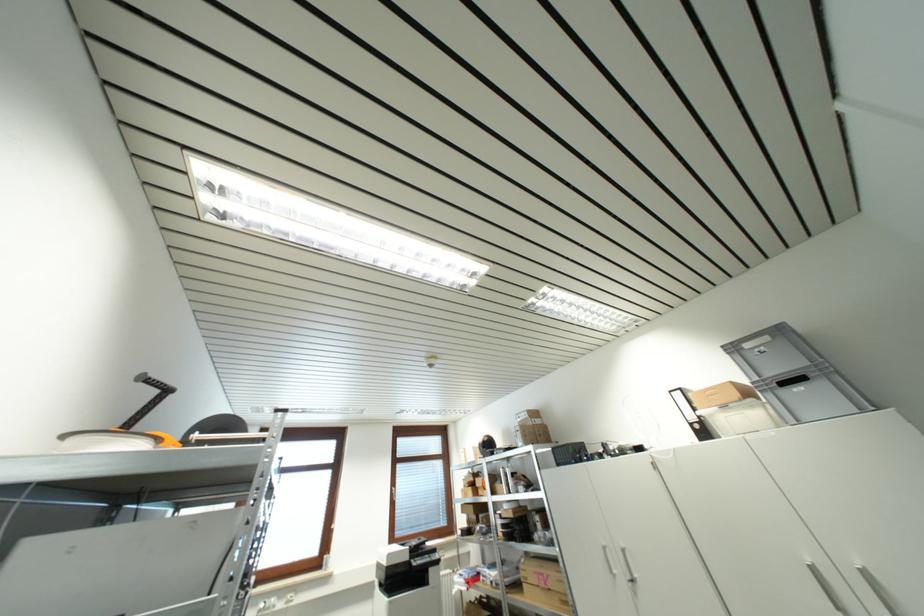
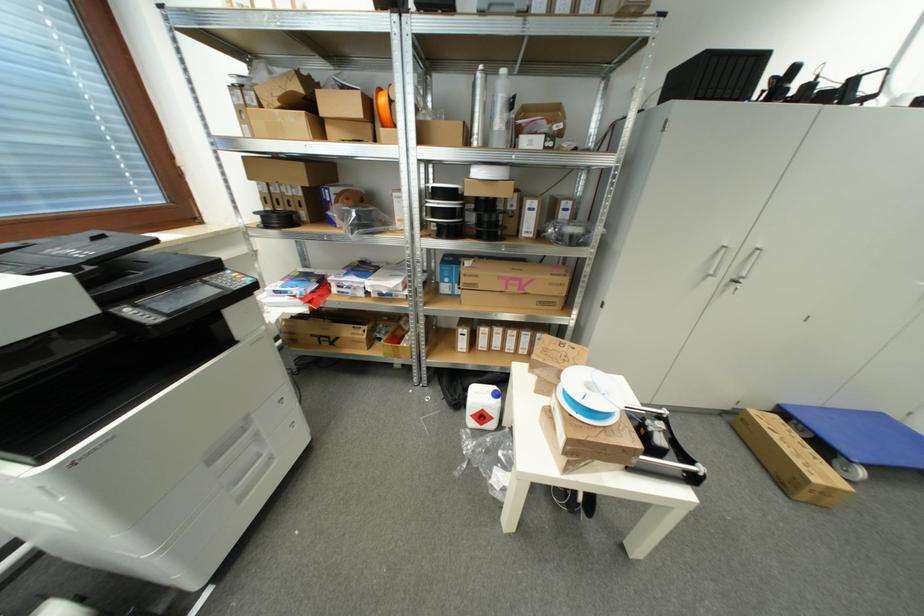
Find the pixel in the second image that matches [546,586] in the first image.

(517, 292)